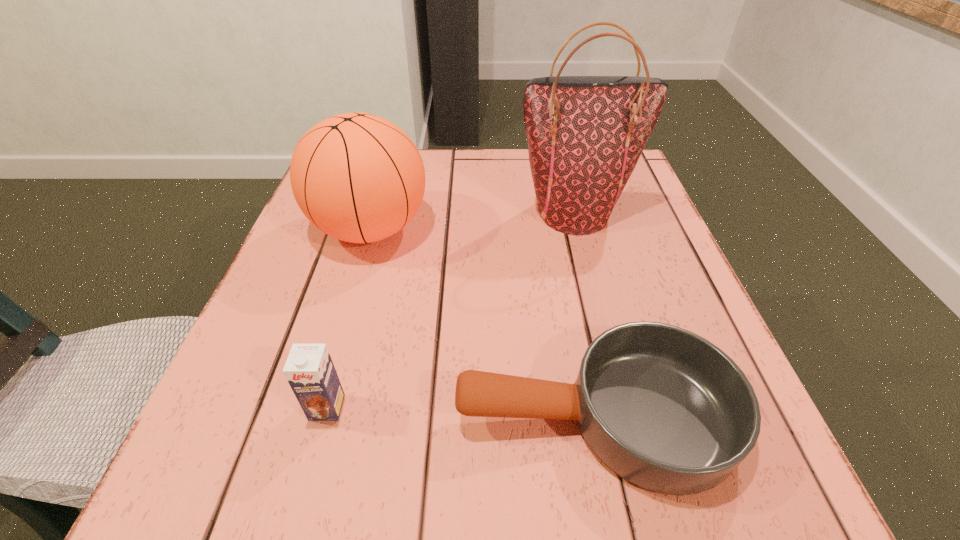
At what (x,y) coordinates should I click in order to perform the action: click on handbag. Please return your answer as a coordinate pair (x, y). The height and width of the screenshot is (540, 960). Looking at the image, I should click on (585, 134).

Identify the location of the third shortest object. The height and width of the screenshot is (540, 960). (357, 177).

The height and width of the screenshot is (540, 960). What are the coordinates of `chocolate milk` in the screenshot? It's located at click(x=309, y=370).

This screenshot has height=540, width=960. Identify the location of the shortest object. (665, 409).

Locate an element on the screen. The height and width of the screenshot is (540, 960). vacant position located 0.180m on the back of the tallest object is located at coordinates (559, 153).

Locate an element on the screen. Image resolution: width=960 pixels, height=540 pixels. free space located on the right of the third shortest object is located at coordinates (564, 229).

Identify the location of vacant point located 0.120m on the front label of the third tallest object. (298, 515).

Identify the location of free space located 0.050m on the handle side of the shortest object. This screenshot has height=540, width=960. (420, 416).

What are the coordinates of `free region located 0.270m on the handle side of the shortest object` in the screenshot? It's located at (262, 416).

Identify the location of free spot located on the handle side of the shortest object. (334, 416).